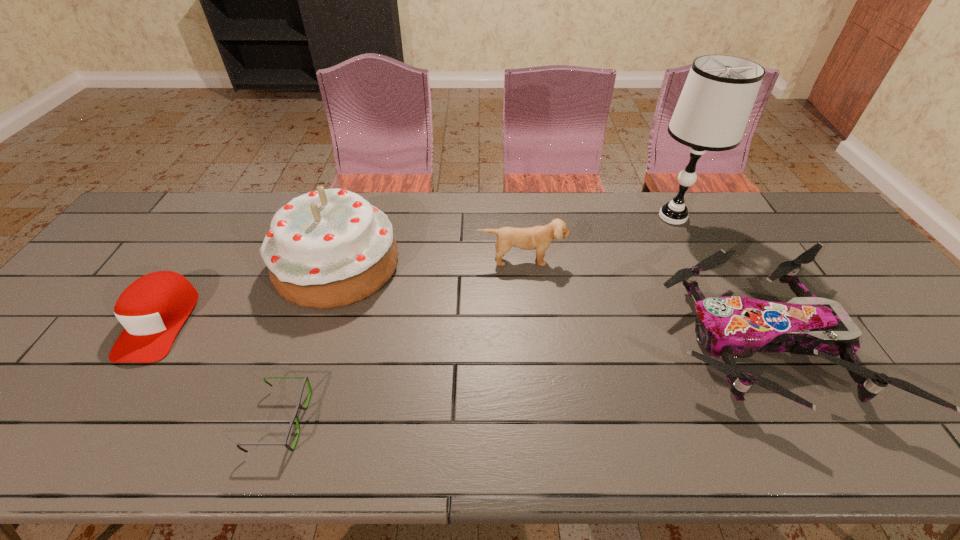
Identify the location of free space located 0.350m on the front-facing side of the drone. (519, 341).

This screenshot has height=540, width=960. What are the coordinates of `vacant area situated on the front-facing side of the drone` in the screenshot? It's located at (592, 341).

The height and width of the screenshot is (540, 960). I want to click on vacant space positioned 0.130m on the front-facing side of the drone, so click(609, 341).

This screenshot has width=960, height=540. Identify the location of free space located 0.130m on the front-facing side of the baseball cap. (97, 417).

The image size is (960, 540). Find the location of `vacant space located 0.100m on the lens of the shortest object`. vacant space located 0.100m on the lens of the shortest object is located at coordinates (350, 420).

This screenshot has height=540, width=960. Find the location of `table lamp that is at the far edge`. table lamp that is at the far edge is located at coordinates (712, 112).

Where is `cake located in the far edge section of the desktop`? This screenshot has width=960, height=540. cake located in the far edge section of the desktop is located at coordinates (329, 248).

Where is `drone located at the near edge`? The image size is (960, 540). drone located at the near edge is located at coordinates (731, 327).

Identify the location of spectacles that is at the near edge. This screenshot has height=540, width=960. (298, 406).

Where is `vacant space at the far edge of the desktop`? vacant space at the far edge of the desktop is located at coordinates (433, 199).